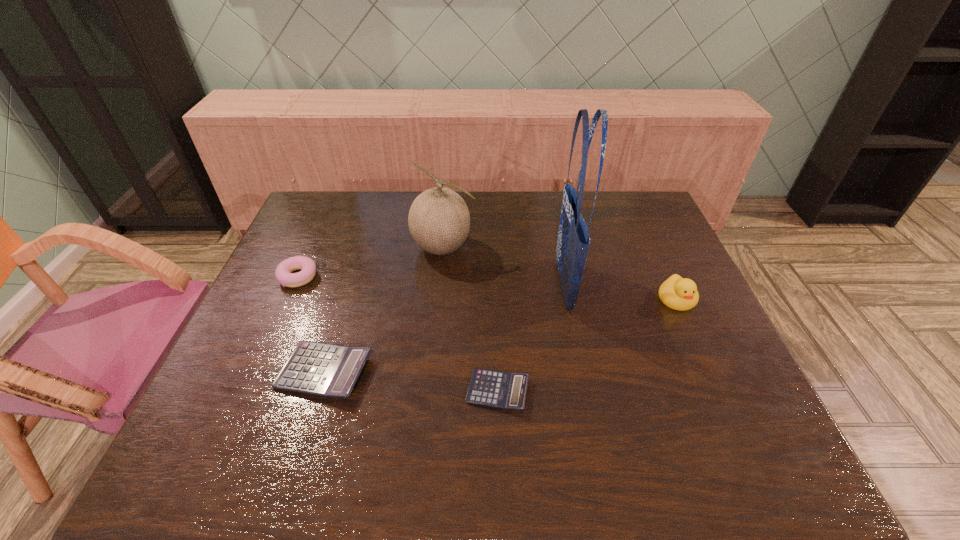
Locate an element on the screen. The image size is (960, 540). doughnut at the left edge is located at coordinates (283, 273).

Locate an element on the screen. object located at the right edge is located at coordinates (677, 293).

The height and width of the screenshot is (540, 960). I want to click on object that is at the near left corner, so point(328,370).

This screenshot has width=960, height=540. Find the location of `vacant space at the far edge`. vacant space at the far edge is located at coordinates (490, 212).

Where is `vacant area at the near edge`? The width and height of the screenshot is (960, 540). vacant area at the near edge is located at coordinates (418, 389).

Find the location of a particular element. The height and width of the screenshot is (540, 960). vacant space at the left edge of the desktop is located at coordinates (321, 286).

Locate an element on the screen. This screenshot has height=540, width=960. free space at the right edge of the desktop is located at coordinates (634, 260).

Identify the location of free point between the fifth object from left to right and the rightmost object. click(620, 292).

Locate an element on the screen. The width and height of the screenshot is (960, 540). vacant space that's between the third tallest object and the right calculator is located at coordinates 588,345.

This screenshot has width=960, height=540. In order to click on free space between the taller calculator and the shorter calculator in this screenshot , I will do `click(411, 381)`.